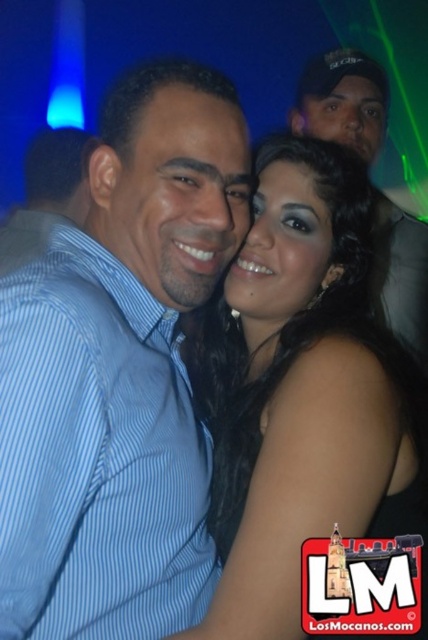
You are a photographer at the party and want to take a closeup of the black satin dress at center without the black cap at upper right appearing in the background. Is this possible?

The black satin dress at center is closer to the viewer than the black cap at upper right, so if you focus on the black satin dress at center and ensure the cap is out of frame, it won

You are at a party and want to find the black cap at upper right. Which direction should you look from the black satin dress at center?

The black satin dress at center is to the left of the black cap at upper right, so you should look to the right from the black satin dress at center to find the black cap at upper right.